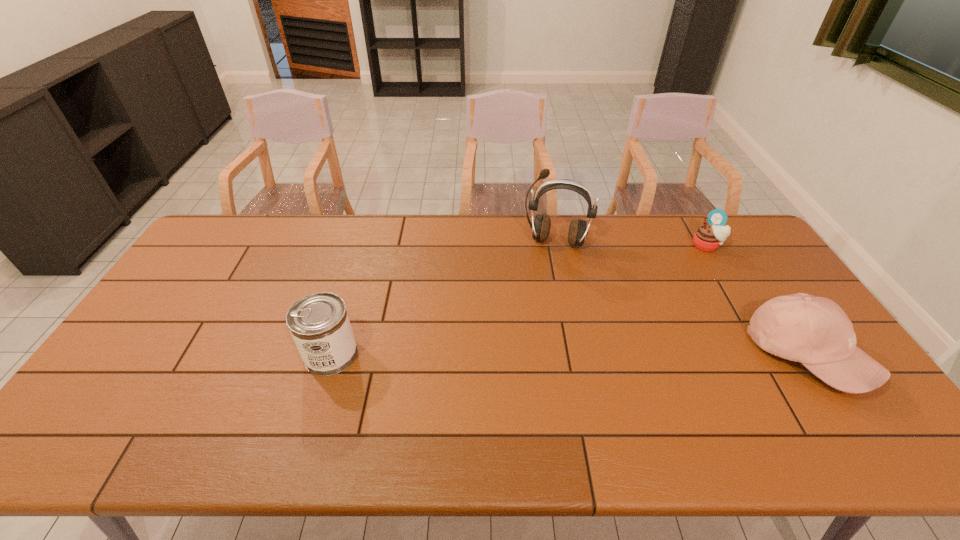
Where is `vacant point at the near edge`? This screenshot has height=540, width=960. vacant point at the near edge is located at coordinates (206, 402).

Where is `free region at the left edge of the desktop`? This screenshot has width=960, height=540. free region at the left edge of the desktop is located at coordinates (201, 312).

This screenshot has height=540, width=960. I want to click on blank space at the far left corner, so click(234, 249).

Identify the location of vacant space in between the baseball cap and the third object from right to left. The height and width of the screenshot is (540, 960). (681, 298).

In order to click on free spot between the shortest object and the earphone in this screenshot , I will do [631, 244].

Where is `vacant space in between the baseball cap and the leftmost object`? vacant space in between the baseball cap and the leftmost object is located at coordinates (568, 354).

Find the location of a particular element. The image size is (960, 540). free space between the baseball cap and the earphone is located at coordinates (x=681, y=298).

The width and height of the screenshot is (960, 540). Find the location of `vacant space in between the third object from right to left and the can`. vacant space in between the third object from right to left and the can is located at coordinates (444, 298).

Locate an element on the screen. vacant area between the tallest object and the baseball cap is located at coordinates (681, 298).

This screenshot has width=960, height=540. In order to click on free space between the leftmost object and the tallest object in this screenshot , I will do `click(444, 298)`.